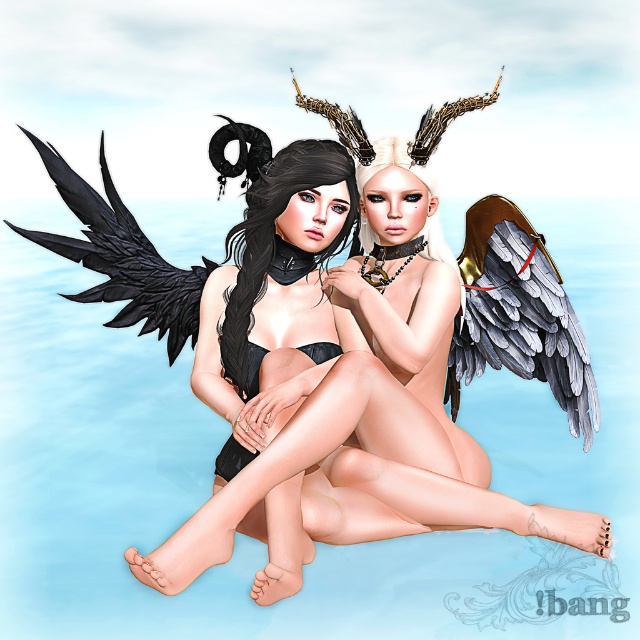
Question: Does black matte wings at upper left have a larger size compared to black matte wing at left?

Choices:
 (A) yes
 (B) no

Answer: (A)

Question: Where is shiny metallic wing at right located in relation to black matte wing at left in the image?

Choices:
 (A) above
 (B) below

Answer: (B)

Question: Which object is closer to the camera taking this photo?

Choices:
 (A) shiny metallic wing at right
 (B) black matte wings at upper left
 (C) black matte wing at left

Answer: (B)

Question: Which of these objects is positioned closest to the black matte wings at upper left?

Choices:
 (A) shiny metallic wing at right
 (B) black matte wing at left

Answer: (A)

Question: Which object is the closest to the black matte wings at upper left?

Choices:
 (A) black matte wing at left
 (B) shiny metallic wing at right

Answer: (B)

Question: Does black matte wings at upper left have a larger size compared to black matte wing at left?

Choices:
 (A) yes
 (B) no

Answer: (A)